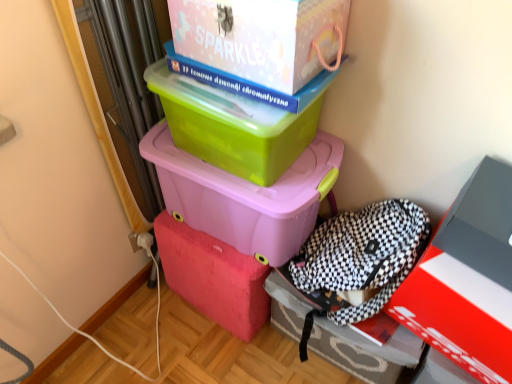
Question: Considering the positions of matte plastic storage box at center, which is the 3th box from bottom to top, and green plastic box at upper center, which is the second box from top to bottom, in the image, is matte plastic storage box at center, which is the 3th box from bottom to top, bigger or smaller than green plastic box at upper center, which is the second box from top to bottom,?

Choices:
 (A) big
 (B) small

Answer: (A)

Question: Relative to green plastic box at upper center, which is counted as the 4th box, starting from the bottom, is matte plastic storage box at center, marked as the third box in a top-to-bottom arrangement, in front or behind?

Choices:
 (A) behind
 (B) front

Answer: (A)

Question: Based on their relative distances, which object is nearer to the matte red box at lower right, positioned as the 2th box in bottom-to-top order?

Choices:
 (A) checkered fabric backpack at lower right, which appears as the 5th box when viewed from the top
 (B) matte plastic storage box at center, marked as the third box in a top-to-bottom arrangement
 (C) green plastic box at upper center, which is counted as the 4th box, starting from the bottom
 (D) matte white cardboard box at upper center, the first box viewed from the top

Answer: (A)

Question: Which object is the closest to the checkered fabric backpack at lower right, arranged as the first box when ordered from the bottom?

Choices:
 (A) matte red box at lower right, placed as the fourth box when sorted from top to bottom
 (B) matte plastic storage box at center, marked as the third box in a top-to-bottom arrangement
 (C) matte white cardboard box at upper center, the first box viewed from the top
 (D) green plastic box at upper center, which is counted as the 4th box, starting from the bottom

Answer: (A)